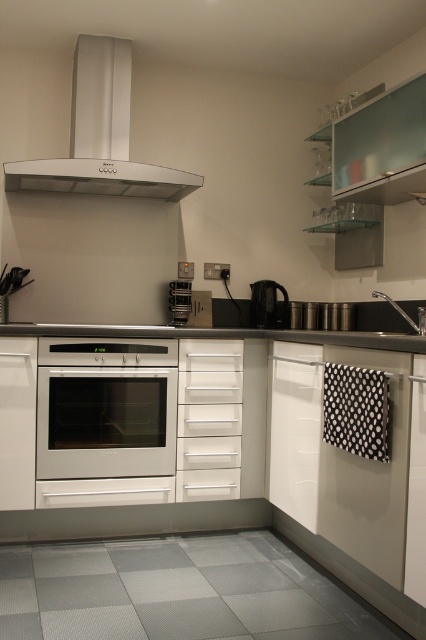
Does white matte drawer at center have a greater height compared to black plastic kettle at center?

Yes, white matte drawer at center is taller than black plastic kettle at center.

What do you see at coordinates (209, 419) in the screenshot? The image size is (426, 640). I see `white matte drawer at center` at bounding box center [209, 419].

This screenshot has height=640, width=426. Find the location of `white matte drawer at center`. white matte drawer at center is located at coordinates (209, 419).

Who is shorter, black granite countertop at center or black plastic kettle at center?

Standing shorter between the two is black granite countertop at center.

Who is taller, black granite countertop at center or black plastic kettle at center?

Standing taller between the two is black plastic kettle at center.

Measure the distance between point [181,337] and camera.

Point [181,337] is 2.95 meters away from camera.

You are a GUI agent. You are given a task and a screenshot of the screen. Output one action in this format:
    pyautogui.click(x=<x>, y=<y>)
    Task: Click on the black granite countertop at center
    
    Given the screenshot: What is the action you would take?
    [x=222, y=333]

Is point (218, 442) positioned before point (62, 330)?

No, it is not.

Is white matte drawer at center to the right of black granite countertop at center from the viewer's perspective?

No, white matte drawer at center is not to the right of black granite countertop at center.

Is point (180, 420) closer to viewer compared to point (184, 332)?

That is False.

The width and height of the screenshot is (426, 640). What are the coordinates of `white matte drawer at center` in the screenshot? It's located at (209, 419).